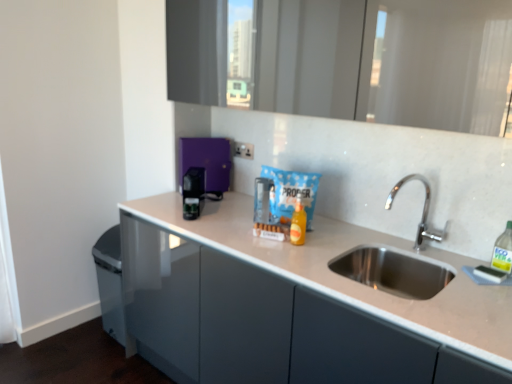
What do you see at coordinates (207, 161) in the screenshot? Image resolution: width=512 pixels, height=384 pixels. I see `purple glossy coffee machine at center, the second appliance from the front` at bounding box center [207, 161].

What is the approximate height of green translucent bottle at right, which is the first bottle from front to back?

green translucent bottle at right, which is the first bottle from front to back, is 8.10 inches tall.

The height and width of the screenshot is (384, 512). Describe the element at coordinates (503, 250) in the screenshot. I see `green translucent bottle at right, which is the 2th bottle in back-to-front order` at that location.

I want to click on purple glossy coffee machine at center, the second appliance from the front, so click(207, 161).

Is purple glossy coffee machine at center, the second appliance from the front, completely or partially outside of green translucent bottle at right, which appears as the 1th bottle when viewed from the right?

Yes, purple glossy coffee machine at center, the second appliance from the front, is not within green translucent bottle at right, which appears as the 1th bottle when viewed from the right.

In terms of size, does purple glossy coffee machine at center, which appears as the first appliance when viewed from the back, appear bigger or smaller than green translucent bottle at right, which is the first bottle from front to back?

purple glossy coffee machine at center, which appears as the first appliance when viewed from the back, is bigger than green translucent bottle at right, which is the first bottle from front to back.

In the scene shown: Visually, is purple glossy coffee machine at center, which appears as the first appliance when viewed from the back, positioned to the left or to the right of green translucent bottle at right, which is the 2th bottle in left-to-right order?

Clearly, purple glossy coffee machine at center, which appears as the first appliance when viewed from the back, is on the left of green translucent bottle at right, which is the 2th bottle in left-to-right order, in the image.

In the scene shown: Is purple glossy coffee machine at center, the second appliance from the front, situated inside black plastic coffee machine at center, acting as the 2th appliance starting from the back, or outside?

purple glossy coffee machine at center, the second appliance from the front, is located beyond the bounds of black plastic coffee machine at center, acting as the 2th appliance starting from the back.

Can you confirm if purple glossy coffee machine at center, which appears as the first appliance when viewed from the back, is thinner than black plastic coffee machine at center, acting as the 2th appliance starting from the back?

Yes, purple glossy coffee machine at center, which appears as the first appliance when viewed from the back, is thinner than black plastic coffee machine at center, acting as the 2th appliance starting from the back.

From a real-world perspective, which is physically below, purple glossy coffee machine at center, which appears as the first appliance when viewed from the back, or black plastic coffee machine at center, acting as the 2th appliance starting from the back?

black plastic coffee machine at center, acting as the 2th appliance starting from the back.

The height and width of the screenshot is (384, 512). I want to click on appliance behind the black plastic coffee machine at center, the 1th appliance in the front-to-back sequence, so click(x=207, y=161).

From the image's perspective, is green translucent bottle at right, which is the first bottle from front to back, under purple glossy coffee machine at center, the second appliance from the front?

Yes, from the image's perspective, green translucent bottle at right, which is the first bottle from front to back, is beneath purple glossy coffee machine at center, the second appliance from the front.

From a real-world perspective, is green translucent bottle at right, which is the 2th bottle in left-to-right order, positioned above or below purple glossy coffee machine at center, the second appliance from the front?

From a real-world perspective, green translucent bottle at right, which is the 2th bottle in left-to-right order, is physically below purple glossy coffee machine at center, the second appliance from the front.

Between green translucent bottle at right, which is the 2th bottle in left-to-right order, and purple glossy coffee machine at center, which appears as the first appliance when viewed from the back, which one has more height?

purple glossy coffee machine at center, which appears as the first appliance when viewed from the back, is taller.

Are white glossy countertop at center and green translucent bottle at right, which appears as the 1th bottle when viewed from the right, beside each other?

white glossy countertop at center and green translucent bottle at right, which appears as the 1th bottle when viewed from the right, are not in contact.

From their relative heights in the image, would you say white glossy countertop at center is taller or shorter than green translucent bottle at right, which is the 2th bottle in back-to-front order?

Clearly, white glossy countertop at center is taller compared to green translucent bottle at right, which is the 2th bottle in back-to-front order.

From a real-world perspective, which object stands above the other?

green translucent bottle at right, which is the first bottle from front to back.

Where is `the 2nd bottle located above the white glossy countertop at center (from a real-world perspective)`? The width and height of the screenshot is (512, 384). the 2nd bottle located above the white glossy countertop at center (from a real-world perspective) is located at coordinates (503, 250).

Is green translucent bottle at right, which is the first bottle from front to back, smaller than white glossy countertop at center?

Correct, green translucent bottle at right, which is the first bottle from front to back, occupies less space than white glossy countertop at center.

From the image's perspective, is green translucent bottle at right, which appears as the 1th bottle when viewed from the right, beneath white glossy countertop at center?

No.

Is black plastic coffee machine at center, acting as the 2th appliance starting from the back, inside the boundaries of translucent orange bottle at center, the second bottle positioned from the right, or outside?

black plastic coffee machine at center, acting as the 2th appliance starting from the back, exists outside the volume of translucent orange bottle at center, the second bottle positioned from the right.

Who is smaller, black plastic coffee machine at center, acting as the 2th appliance starting from the back, or translucent orange bottle at center, the second bottle positioned from the right?

With smaller size is translucent orange bottle at center, the second bottle positioned from the right.

Based on the photo, is black plastic coffee machine at center, acting as the 2th appliance starting from the back, turned away from translucent orange bottle at center, which is counted as the first bottle, starting from the left?

black plastic coffee machine at center, acting as the 2th appliance starting from the back, does not have its back to translucent orange bottle at center, which is counted as the first bottle, starting from the left.

Looking at this image, from the image's perspective, is black plastic coffee machine at center, acting as the 2th appliance starting from the back, positioned above or below translucent orange bottle at center, the second bottle positioned from the front?

black plastic coffee machine at center, acting as the 2th appliance starting from the back, is situated higher than translucent orange bottle at center, the second bottle positioned from the front, in the image.

How far apart are white plastic electric outlet at center and translucent orange bottle at center, the second bottle positioned from the right?

A distance of 27.26 inches exists between white plastic electric outlet at center and translucent orange bottle at center, the second bottle positioned from the right.

From a real-world perspective, is white plastic electric outlet at center above or below translucent orange bottle at center, the second bottle positioned from the front?

In terms of real-world spatial position, white plastic electric outlet at center is above translucent orange bottle at center, the second bottle positioned from the front.

Is point (247, 158) closer to camera compared to point (292, 224)?

No.

Between white plastic electric outlet at center and translucent orange bottle at center, the second bottle positioned from the front, which one appears on the right side from the viewer's perspective?

Positioned to the right is translucent orange bottle at center, the second bottle positioned from the front.

From the image's perspective, count 2nd appliances upward from the green translucent bottle at right, which appears as the 1th bottle when viewed from the right, and point to it. Please provide its 2D coordinates.

[(207, 161)]

Identify the location of appliance on the right of black plastic coffee machine at center, acting as the 2th appliance starting from the back. (207, 161).

Based on the photo, which object lies nearer to the anchor point green translucent bottle at right, which is the 2th bottle in left-to-right order, purple glossy coffee machine at center, the second appliance from the front, or white plastic electric outlet at center?

The object closer to green translucent bottle at right, which is the 2th bottle in left-to-right order, is white plastic electric outlet at center.

When comparing their distances from white glossy countertop at center, does translucent orange bottle at center, the second bottle positioned from the front, or green translucent bottle at right, which is the 2th bottle in left-to-right order, seem further?

green translucent bottle at right, which is the 2th bottle in left-to-right order.

From the image, which object appears to be farther from black plastic coffee machine at center, acting as the 2th appliance starting from the back, translucent orange bottle at center, which is the first bottle from back to front, or white plastic electric outlet at center?

translucent orange bottle at center, which is the first bottle from back to front, lies further to black plastic coffee machine at center, acting as the 2th appliance starting from the back, than the other object.

Based on their spatial positions, is black plastic coffee machine at center, the 1th appliance in the front-to-back sequence, or translucent orange bottle at center, which is the first bottle from back to front, further from white plastic electric outlet at center?

The object further to white plastic electric outlet at center is translucent orange bottle at center, which is the first bottle from back to front.

Estimate the real-world distances between objects in this image. Which object is closer to white glossy countertop at center, purple glossy coffee machine at center, which appears as the first appliance when viewed from the back, or black plastic coffee machine at center, acting as the 2th appliance starting from the back?

black plastic coffee machine at center, acting as the 2th appliance starting from the back.

From the picture: Estimate the real-world distances between objects in this image. Which object is further from white plastic electric outlet at center, white glossy countertop at center or translucent orange bottle at center, the second bottle positioned from the front?

white glossy countertop at center.

Based on their spatial positions, is white plastic electric outlet at center or white glossy countertop at center further from translucent orange bottle at center, which is the first bottle from back to front?

white plastic electric outlet at center.

Looking at the image, which one is located further to black plastic coffee machine at center, acting as the 2th appliance starting from the back, translucent orange bottle at center, which is counted as the first bottle, starting from the left, or purple glossy coffee machine at center, the second appliance from the front?

translucent orange bottle at center, which is counted as the first bottle, starting from the left.

Find the location of `electric outlet situated between black plastic coffee machine at center, acting as the 2th appliance starting from the back, and green translucent bottle at right, which appears as the 1th bottle when viewed from the right, from left to right`. electric outlet situated between black plastic coffee machine at center, acting as the 2th appliance starting from the back, and green translucent bottle at right, which appears as the 1th bottle when viewed from the right, from left to right is located at coordinates (244, 150).

You are a GUI agent. You are given a task and a screenshot of the screen. Output one action in this format:
    pyautogui.click(x=<x>, y=<y>)
    Task: Click on the bottle located between purple glossy coffee machine at center, the second appliance from the front, and green translucent bottle at right, which is the first bottle from front to back, in the left-right direction
    
    Given the screenshot: What is the action you would take?
    pyautogui.click(x=298, y=224)

The width and height of the screenshot is (512, 384). I want to click on appliance between translucent orange bottle at center, which is counted as the first bottle, starting from the left, and purple glossy coffee machine at center, the second appliance from the front, along the z-axis, so click(193, 192).

Locate an element on the screen. The image size is (512, 384). appliance positioned between white glossy countertop at center and purple glossy coffee machine at center, which appears as the first appliance when viewed from the back, from near to far is located at coordinates (193, 192).